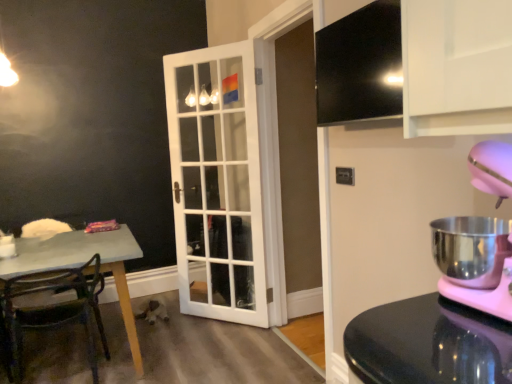
Question: Does pink plastic mixer at right have a larger size compared to white glossy coffee cup at lower left?

Choices:
 (A) yes
 (B) no

Answer: (A)

Question: Does pink plastic mixer at right lie behind white glossy coffee cup at lower left?

Choices:
 (A) no
 (B) yes

Answer: (A)

Question: Does pink plastic mixer at right have a greater width compared to white glossy coffee cup at lower left?

Choices:
 (A) yes
 (B) no

Answer: (A)

Question: Is pink plastic mixer at right positioned far away from white glossy coffee cup at lower left?

Choices:
 (A) yes
 (B) no

Answer: (A)

Question: Is pink plastic mixer at right turned away from white glossy coffee cup at lower left?

Choices:
 (A) no
 (B) yes

Answer: (A)

Question: Is pink plastic mixer at right not within white glossy coffee cup at lower left?

Choices:
 (A) yes
 (B) no

Answer: (A)

Question: From a real-world perspective, is pink plastic mixer at right physically above white glass door at center?

Choices:
 (A) no
 (B) yes

Answer: (B)

Question: Would you say white glass door at center is part of pink plastic mixer at right's contents?

Choices:
 (A) yes
 (B) no

Answer: (B)

Question: Is pink plastic mixer at right taller than white glass door at center?

Choices:
 (A) no
 (B) yes

Answer: (A)

Question: Does pink plastic mixer at right have a lesser height compared to white glass door at center?

Choices:
 (A) yes
 (B) no

Answer: (A)

Question: Can you confirm if pink plastic mixer at right is positioned to the left of white glass door at center?

Choices:
 (A) no
 (B) yes

Answer: (A)

Question: Can you confirm if pink plastic mixer at right is wider than white glass door at center?

Choices:
 (A) no
 (B) yes

Answer: (B)

Question: Does black glossy exhaust hood at upper right turn towards metallic green chair at left?

Choices:
 (A) yes
 (B) no

Answer: (B)